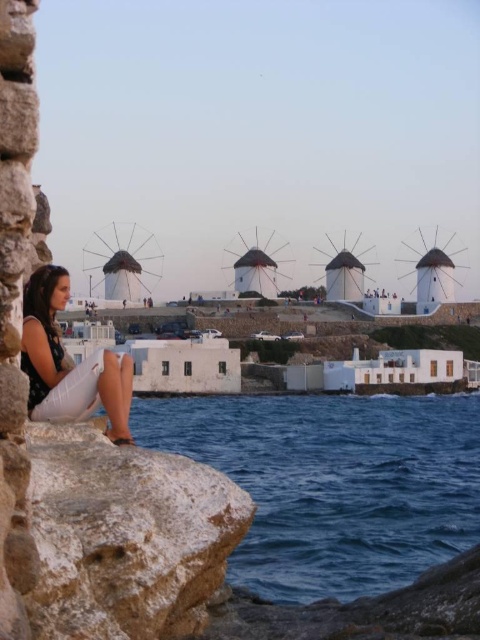
Is blue water at lower left below matte black dress at lower left?

Indeed, blue water at lower left is positioned under matte black dress at lower left.

Can you confirm if blue water at lower left is wider than matte black dress at lower left?

Correct, the width of blue water at lower left exceeds that of matte black dress at lower left.

What do you see at coordinates (334, 483) in the screenshot? The image size is (480, 640). I see `blue water at lower left` at bounding box center [334, 483].

Find the location of a particular element. Image resolution: width=480 pixels, height=640 pixels. blue water at lower left is located at coordinates (334, 483).

Does blue water at lower left lie behind white rough rock at lower left?

Yes, it is behind white rough rock at lower left.

Can you confirm if blue water at lower left is positioned below white rough rock at lower left?

Correct, blue water at lower left is located below white rough rock at lower left.

The image size is (480, 640). Describe the element at coordinates (334, 483) in the screenshot. I see `blue water at lower left` at that location.

Identify the location of blue water at lower left. The height and width of the screenshot is (640, 480). (334, 483).

Who is more forward, (43, 616) or (60, 289)?

Point (43, 616) is in front.

Is point (127, 467) farther from camera compared to point (84, 381)?

That is False.

I want to click on white rough rock at lower left, so click(x=126, y=536).